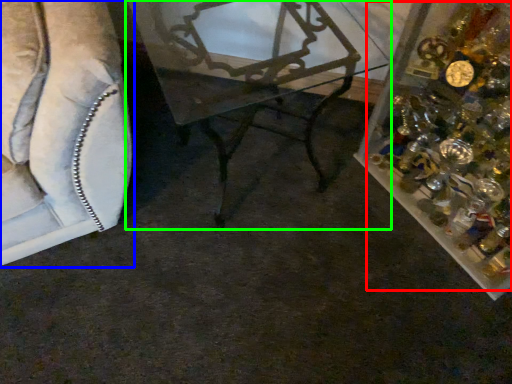
Question: Which is nearer to the christmas decoration (highlighted by a red box)? furniture (highlighted by a blue box) or table (highlighted by a green box).

Choices:
 (A) furniture
 (B) table

Answer: (B)